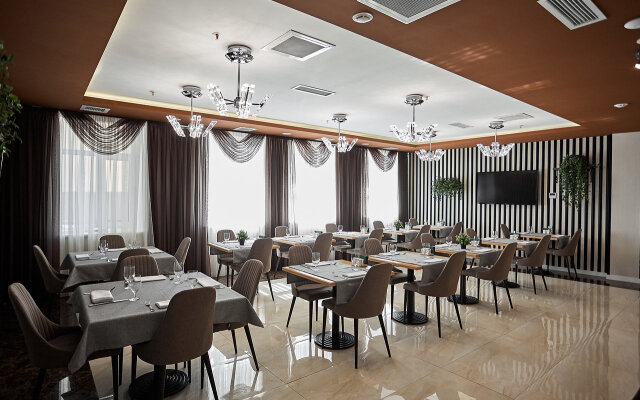
Where is `large windows`? The width and height of the screenshot is (640, 400). large windows is located at coordinates (113, 189), (233, 182), (388, 189), (310, 189).